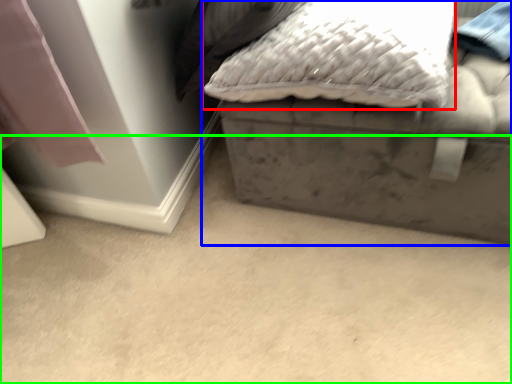
Question: Estimate the real-world distances between objects in this image. Which object is closer to pillow (highlighted by a red box), furniture (highlighted by a blue box) or concrete (highlighted by a green box)?

Choices:
 (A) furniture
 (B) concrete

Answer: (A)